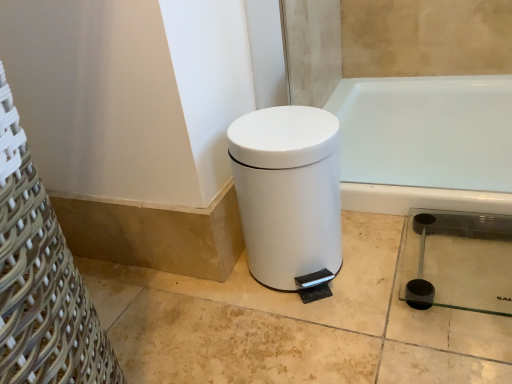
Describe the element at coordinates (288, 193) in the screenshot. I see `white matte waste container at lower center` at that location.

Where is `white matte waste container at lower center`? This screenshot has height=384, width=512. white matte waste container at lower center is located at coordinates (288, 193).

You are a GUI agent. You are given a task and a screenshot of the screen. Output one action in this format:
    pyautogui.click(x=<x>, y=<y>)
    Task: Click on the white matte waste container at lower center
    Image resolution: width=512 pixels, height=384 pixels.
    Given the screenshot: What is the action you would take?
    pyautogui.click(x=288, y=193)